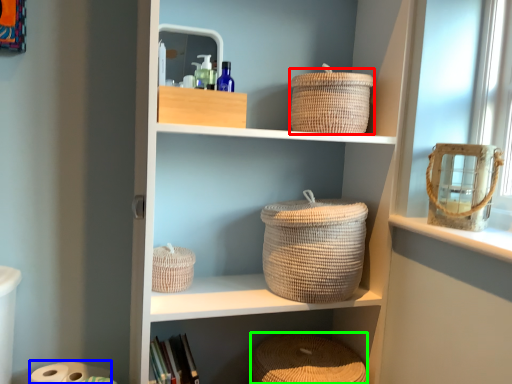
Question: Considering the real-world distances, which object is closest to basket (highlighted by a red box)? toilet paper (highlighted by a blue box) or basket (highlighted by a green box).

Choices:
 (A) toilet paper
 (B) basket

Answer: (B)